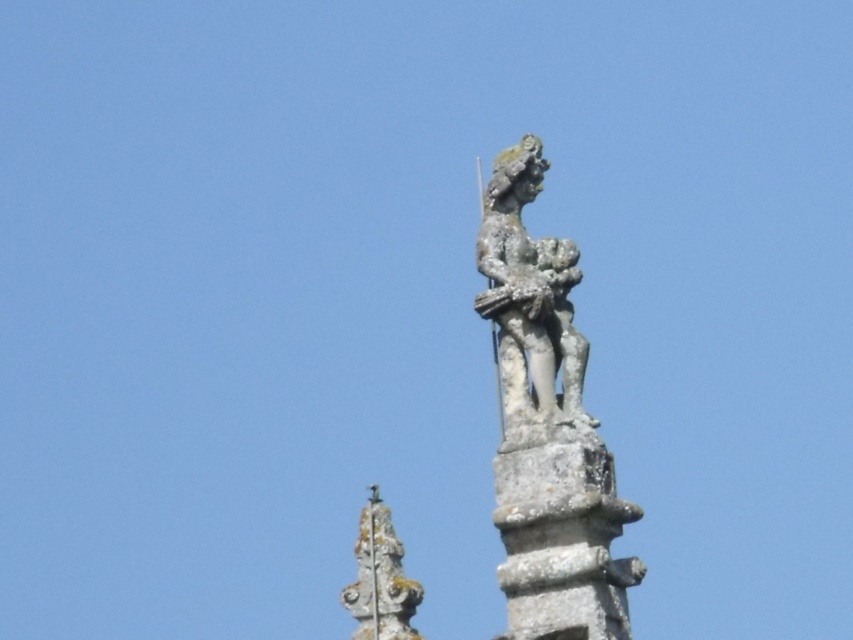
You are an art conservator assessing the statues in the image. You need to determine which statue requires more material for restoration based on their sizes. Which statue would need more material, the rusty stone statue at upper center or the stone statue at center?

The stone statue at center requires more material for restoration because it occupies more space than the rusty stone statue at upper center.

You are an art conservator assessing the statues in the image. You need to determine which statue is narrower between the rusty stone statue at upper center and the stone statue at center. Which one is narrower?

The rusty stone statue at upper center has a lesser width compared to the stone statue at center, so the rusty stone statue at upper center is narrower.